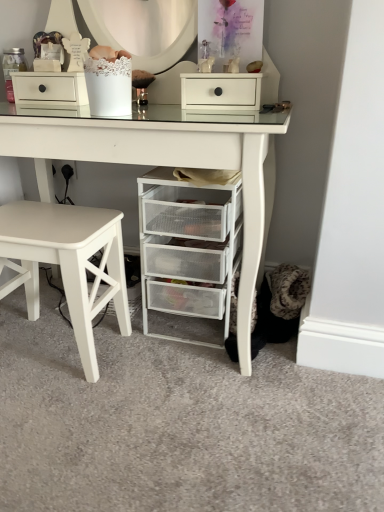
Question: Is white mesh drawer unit at lower center located within white mesh drawer unit at lower right?

Choices:
 (A) yes
 (B) no

Answer: (B)

Question: Is white mesh drawer unit at lower right in front of white mesh drawer unit at lower center?

Choices:
 (A) no
 (B) yes

Answer: (A)

Question: From the image's perspective, is white mesh drawer unit at lower right under white mesh drawer unit at lower center?

Choices:
 (A) yes
 (B) no

Answer: (A)

Question: Considering the relative sizes of white mesh drawer unit at lower right and white mesh drawer unit at lower center in the image provided, is white mesh drawer unit at lower right taller than white mesh drawer unit at lower center?

Choices:
 (A) no
 (B) yes

Answer: (A)

Question: Does white mesh drawer unit at lower right have a lesser height compared to white mesh drawer unit at lower center?

Choices:
 (A) no
 (B) yes

Answer: (B)

Question: From a real-world perspective, is white mesh drawer unit at lower right physically located above or below white matte drawer at upper center?

Choices:
 (A) above
 (B) below

Answer: (B)

Question: Considering the positions of white mesh drawer unit at lower right and white matte drawer at upper center in the image, is white mesh drawer unit at lower right bigger or smaller than white matte drawer at upper center?

Choices:
 (A) small
 (B) big

Answer: (B)

Question: Is white mesh drawer unit at lower right situated inside white matte drawer at upper center or outside?

Choices:
 (A) inside
 (B) outside

Answer: (B)

Question: In the image, is white mesh drawer unit at lower right on the left side or the right side of white matte drawer at upper center?

Choices:
 (A) left
 (B) right

Answer: (A)

Question: From the image's perspective, is white mesh drawer unit at lower center positioned above or below white matte stool at lower left?

Choices:
 (A) below
 (B) above

Answer: (B)

Question: Relative to white matte stool at lower left, is white mesh drawer unit at lower center in front or behind?

Choices:
 (A) front
 (B) behind

Answer: (A)

Question: From a real-world perspective, relative to white matte stool at lower left, is white mesh drawer unit at lower center vertically above or below?

Choices:
 (A) above
 (B) below

Answer: (A)

Question: Is white mesh drawer unit at lower center inside or outside of white matte stool at lower left?

Choices:
 (A) inside
 (B) outside

Answer: (B)

Question: Considering the relative positions of white matte stool at lower left and white mesh drawer unit at lower center in the image provided, is white matte stool at lower left to the left or to the right of white mesh drawer unit at lower center?

Choices:
 (A) right
 (B) left

Answer: (B)

Question: Is white matte stool at lower left in front of or behind white mesh drawer unit at lower center in the image?

Choices:
 (A) front
 (B) behind

Answer: (B)